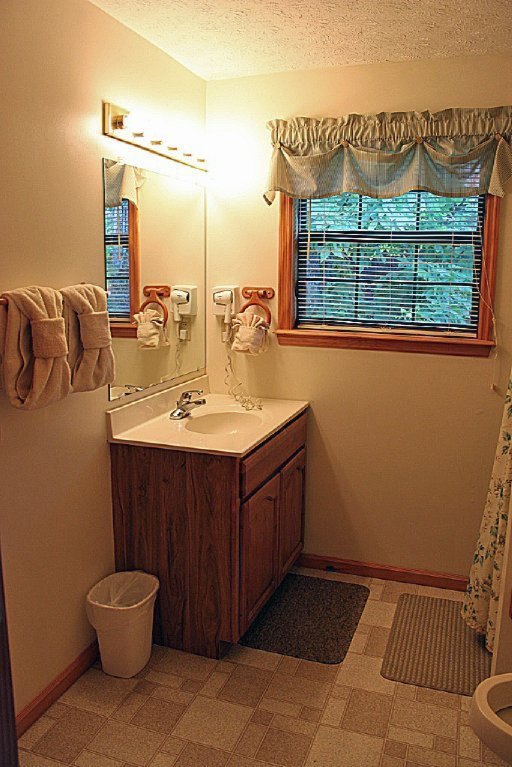
The image size is (512, 767). What are the coordinates of `cabinet` in the screenshot? It's located at (265, 541).